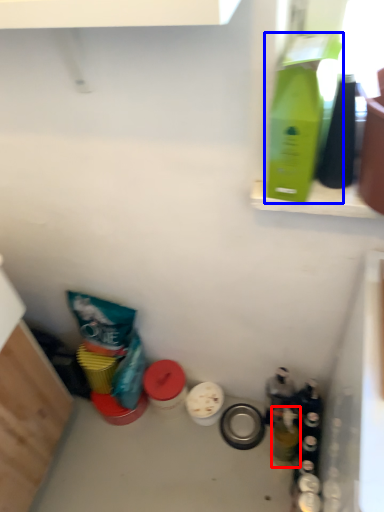
Question: Which of the following is the closest to the observer, bottle (highlighted by a red box) or bottle (highlighted by a blue box)?

Choices:
 (A) bottle
 (B) bottle

Answer: (B)